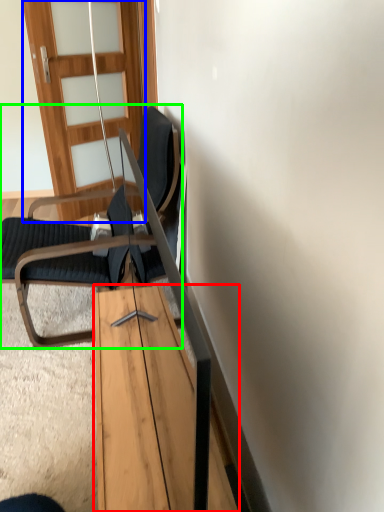
Question: Estimate the real-world distances between objects in this image. Which object is closer to table (highlighted by a red box), door (highlighted by a blue box) or chair (highlighted by a green box)?

Choices:
 (A) door
 (B) chair

Answer: (B)